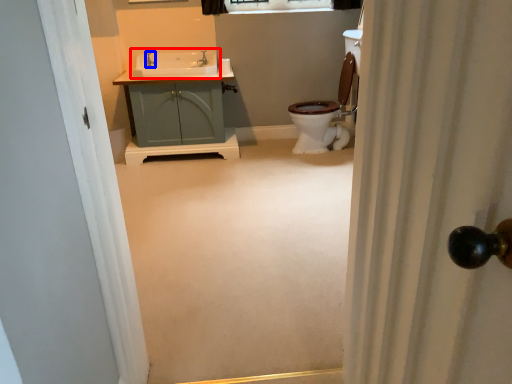
Question: Which point is closer to the camera, sink (highlighted by a red box) or faucet (highlighted by a blue box)?

Choices:
 (A) sink
 (B) faucet

Answer: (A)